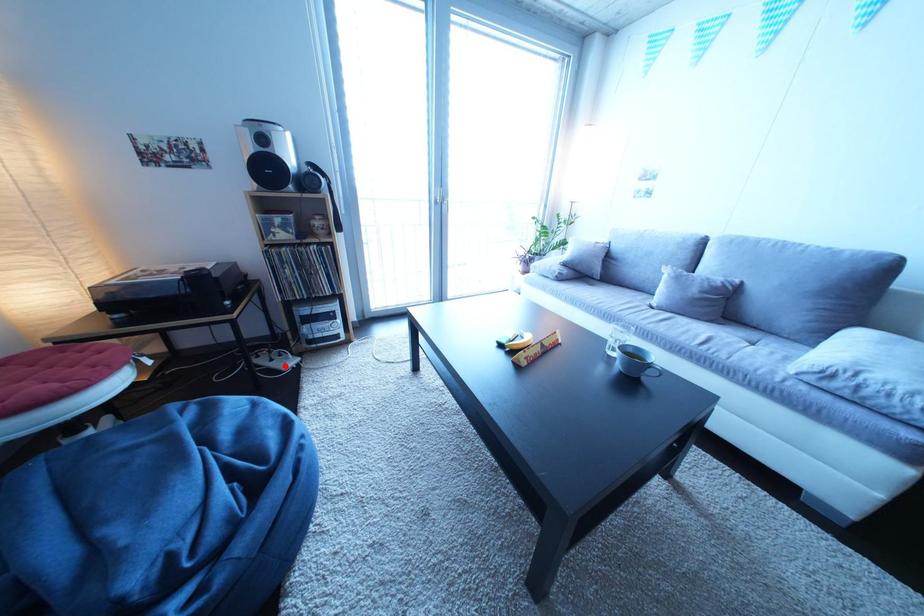
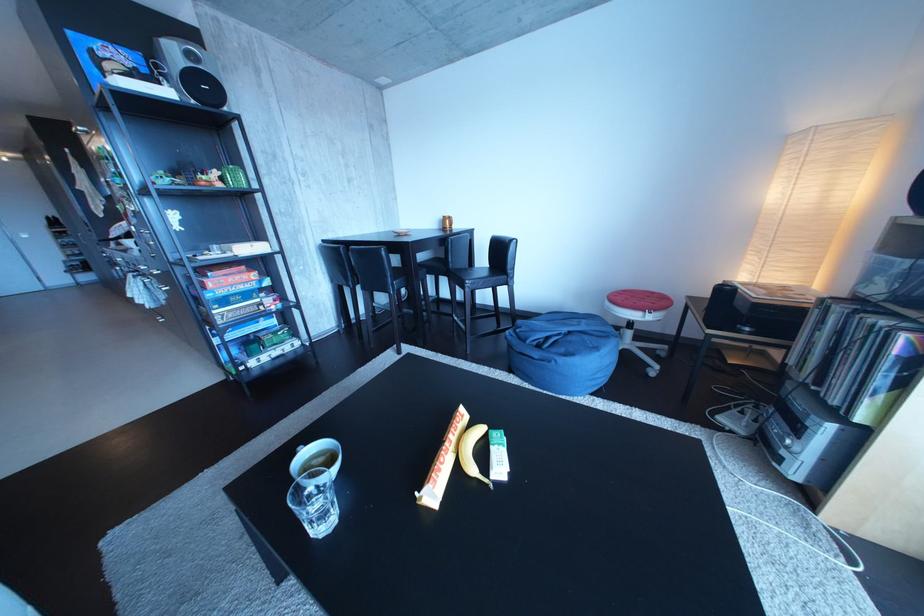
Question: I am providing you with two images of the same scene from different viewpoints. In image1, a red point is highlighted. Considering the same 3D point in image2, which of the following is correct?

Choices:
 (A) It is closer
 (B) It is farther

Answer: (A)